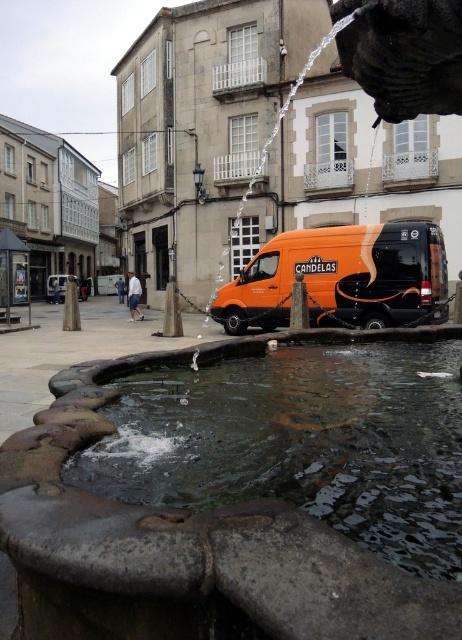
You are a delivery driver who needs to park your orange matte van at center near the dark gray stone water at center. Based on their positions, can you safely park the van so that it doesn not block the water feature?

The dark gray stone water at center is to the left of the orange matte van at center, so parking the van to the right of the water feature would allow it to remain visible and unobstructed.

You are a photographer trying to capture a shot of the dark gray stone water at center and the orange matte van at center. Based on their heights, which object should you focus on first if you want to ensure both are in the frame without moving the camera?

The dark gray stone water at center is shorter than the orange matte van at center, so you should focus on the orange matte van at center first to ensure both are in the frame.

You are a city planner assessing the space around the fountain. You need to determine if the orange matte van at center can be parked perpendicular to the dark gray stone water at center without overlapping. Based on their widths, can the van fit without encroaching on the fountain area?

The dark gray stone water at center is wider than the orange matte van at center. Since the van is narrower, it can be parked perpendicular to the fountain without overlapping, as its width is smaller than the fountain area.